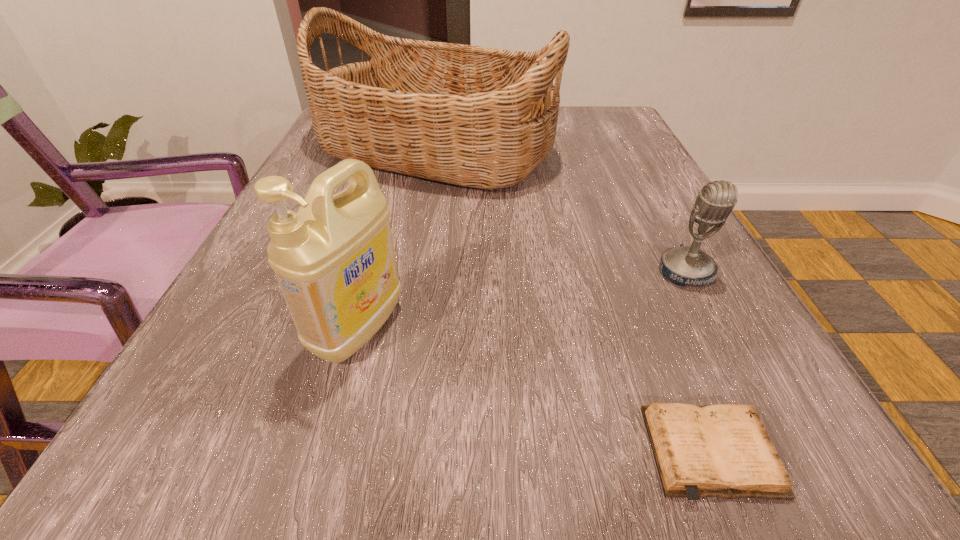
This screenshot has height=540, width=960. Find the location of `object that is at the near edge`. object that is at the near edge is located at coordinates point(724,450).

Where is `basket present at the left edge`? basket present at the left edge is located at coordinates (479, 117).

Locate an element on the screen. detergent positioned at the left edge is located at coordinates (334, 259).

The height and width of the screenshot is (540, 960). What are the coordinates of `microphone that is at the right edge` in the screenshot? It's located at (685, 265).

You are a GUI agent. You are given a task and a screenshot of the screen. Output one action in this format:
    pyautogui.click(x=<x>, y=<y>)
    Task: Click on the diary that is at the right edge
    
    Given the screenshot: What is the action you would take?
    pyautogui.click(x=724, y=450)

Find the location of a particular element. The height and width of the screenshot is (540, 960). object present at the far left corner is located at coordinates (479, 117).

At what (x,y) coordinates should I click in order to perform the action: click on object that is at the near right corner. Please return your answer as a coordinate pair (x, y). Looking at the image, I should click on (724, 450).

Identify the location of vacant space at the far edge. (563, 131).

Identify the location of vacant area at the near edge. The image size is (960, 540). (499, 437).

In order to click on vacant space at the left edge of the desktop in this screenshot , I will do `click(223, 314)`.